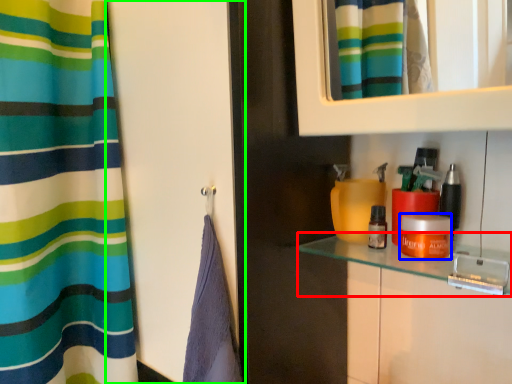
Question: Which object is the closest to the counter top (highlighted by a red box)? Choose among these: cosmetic (highlighted by a blue box) or screen door (highlighted by a green box).

Choices:
 (A) cosmetic
 (B) screen door

Answer: (A)